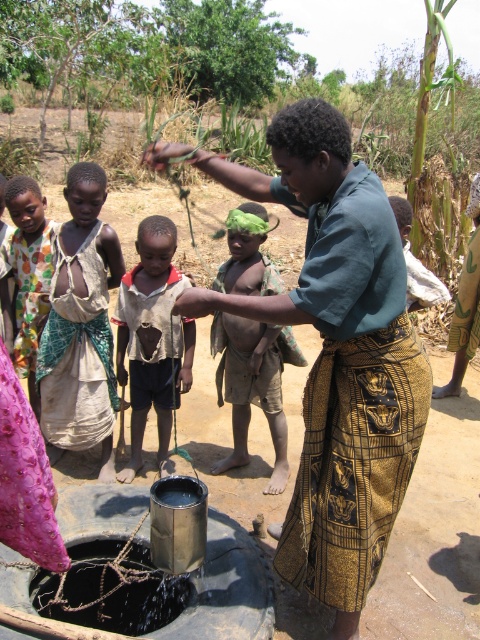
Which of these two, light brown fabric dress at center or polka dot fabric shirt at left, stands shorter?

polka dot fabric shirt at left is shorter.

Which is behind, point (84, 218) or point (26, 230)?

The point (26, 230) is more distant.

Find the location of a particular element. The image size is (480, 640). light brown fabric dress at center is located at coordinates 81,324.

Who is shorter, light brown fabric dress at center or brown textured shorts at center?

brown textured shorts at center

Between light brown fabric dress at center and brown textured shorts at center, which one appears on the right side from the viewer's perspective?

brown textured shorts at center

What do you see at coordinates (81, 324) in the screenshot? Image resolution: width=480 pixels, height=640 pixels. I see `light brown fabric dress at center` at bounding box center [81, 324].

Locate an element on the screen. The width and height of the screenshot is (480, 640). light brown fabric dress at center is located at coordinates (81, 324).

Between brown textured shorts at center and polka dot fabric shirt at left, which one is positioned higher?

polka dot fabric shirt at left is above.

Is the position of brown textured shorts at center more distant than that of polka dot fabric shirt at left?

No, brown textured shorts at center is closer to the viewer.

Between point (239, 403) and point (33, 298), which one is positioned in front?

Positioned in front is point (33, 298).

The image size is (480, 640). I want to click on brown textured shorts at center, so click(252, 387).